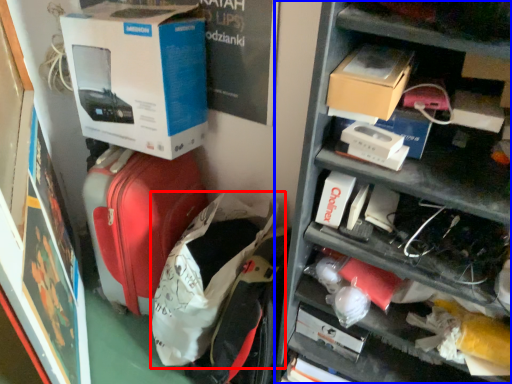
Question: Which object appears closest to the camera in this image, luggage (highlighted by a red box) or shelf (highlighted by a blue box)?

Choices:
 (A) luggage
 (B) shelf

Answer: (B)